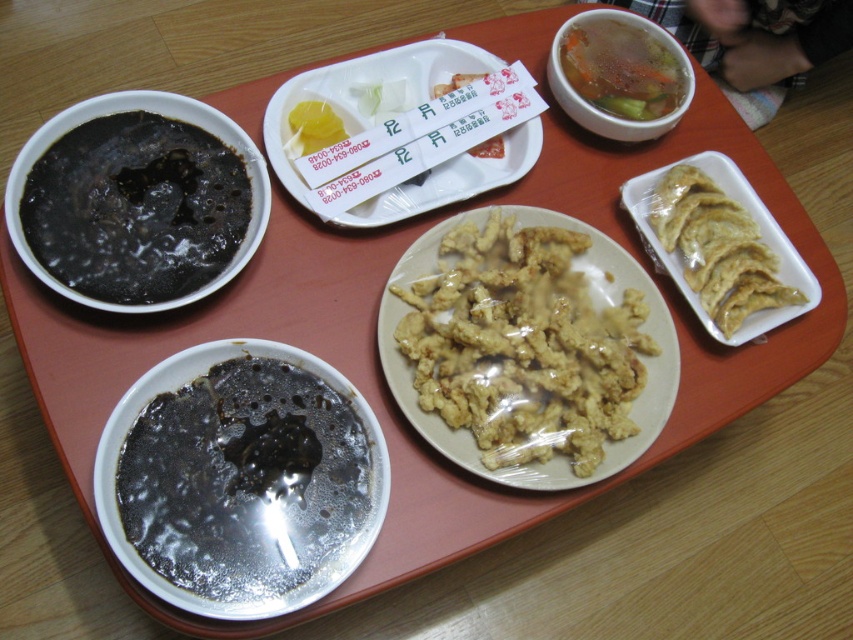
Question: Is golden crispy fried chicken at center wider than white paper receipt at center?

Choices:
 (A) no
 (B) yes

Answer: (B)

Question: Does black glossy soup at lower left have a smaller size compared to yellow paper at center?

Choices:
 (A) no
 (B) yes

Answer: (A)

Question: Based on their relative distances, which object is farther from the translucent plastic dumplings at right?

Choices:
 (A) white paper receipt at center
 (B) yellow paper at center
 (C) black glossy soup at lower left
 (D) black gelatinous soup at top left

Answer: (D)

Question: In this image, where is golden crispy fried chicken at center located relative to yellow paper at center?

Choices:
 (A) left
 (B) right

Answer: (B)

Question: Among these points, which one is farthest from the camera?

Choices:
 (A) (502, 156)
 (B) (318, 140)

Answer: (A)

Question: Which point is closer to the camera?

Choices:
 (A) white paper receipt at center
 (B) clear broth with vegetables at upper right
 (C) translucent plastic dumplings at right
 (D) black glossy soup at lower left

Answer: (D)